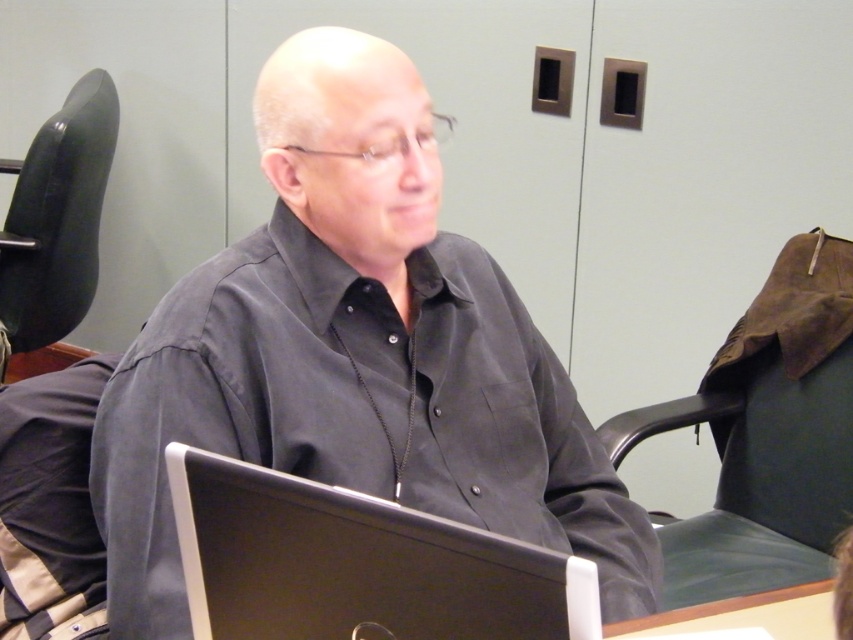
Does point (584, 596) come farther from viewer compared to point (720, 605)?

No.

You are a GUI agent. You are given a task and a screenshot of the screen. Output one action in this format:
    pyautogui.click(x=<x>, y=<y>)
    Task: Click on the black plastic laptop at center
    This screenshot has height=640, width=853.
    Given the screenshot: What is the action you would take?
    pyautogui.click(x=357, y=564)

Is point (486, 547) positioned after point (776, 630)?

No.

Identify the location of black plastic laptop at center. The width and height of the screenshot is (853, 640). (x=357, y=564).

Who is more distant from viewer, (361, 486) or (773, 602)?

Positioned behind is point (773, 602).

Does matte black shirt at center have a lesser width compared to wooden table at lower right?

Incorrect, matte black shirt at center's width is not less than wooden table at lower right's.

Is point (387, 353) closer to camera compared to point (815, 589)?

That is False.

The width and height of the screenshot is (853, 640). What are the coordinates of `matte black shirt at center` in the screenshot? It's located at (354, 353).

What do you see at coordinates (354, 353) in the screenshot? The height and width of the screenshot is (640, 853). I see `matte black shirt at center` at bounding box center [354, 353].

Who is lower down, matte black shirt at center or black leather chair at left?

matte black shirt at center is lower down.

Does point (280, 234) come behind point (20, 189)?

That is False.

Locate an element on the screen. The height and width of the screenshot is (640, 853). matte black shirt at center is located at coordinates (354, 353).